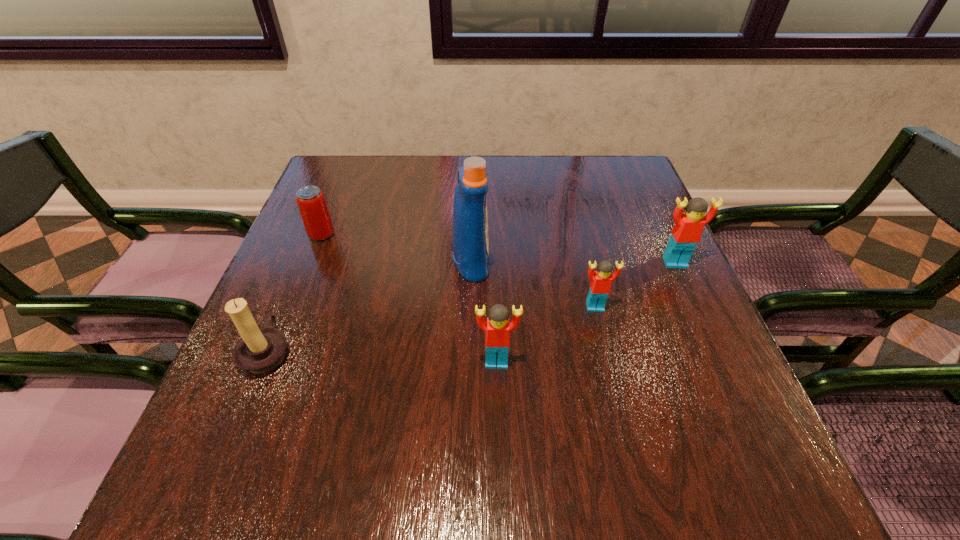
Where is `free spot located on the face of the second Lego from right to left`? free spot located on the face of the second Lego from right to left is located at coordinates (616, 395).

Where is `vacant space located on the face of the rightmost object`? vacant space located on the face of the rightmost object is located at coordinates (714, 348).

The width and height of the screenshot is (960, 540). Identify the location of vacant region located on the back of the beer can. (332, 207).

This screenshot has height=540, width=960. I want to click on blank area located 0.050m on the label of the tallest object, so click(511, 261).

The height and width of the screenshot is (540, 960). Find the location of `free space located 0.350m on the wick of the candle holder`. free space located 0.350m on the wick of the candle holder is located at coordinates (476, 351).

The height and width of the screenshot is (540, 960). What are the coordinates of `beer can situated at the left edge` in the screenshot? It's located at (311, 202).

The image size is (960, 540). In order to click on candle holder at the left edge in this screenshot , I will do `click(260, 350)`.

Image resolution: width=960 pixels, height=540 pixels. Identify the location of object situated at the right edge. click(x=686, y=233).

Image resolution: width=960 pixels, height=540 pixels. In the image, there is a desktop. Identify the location of vacant space at the far edge. (394, 181).

In order to click on free spot at the near edge of the desktop in this screenshot , I will do `click(365, 403)`.